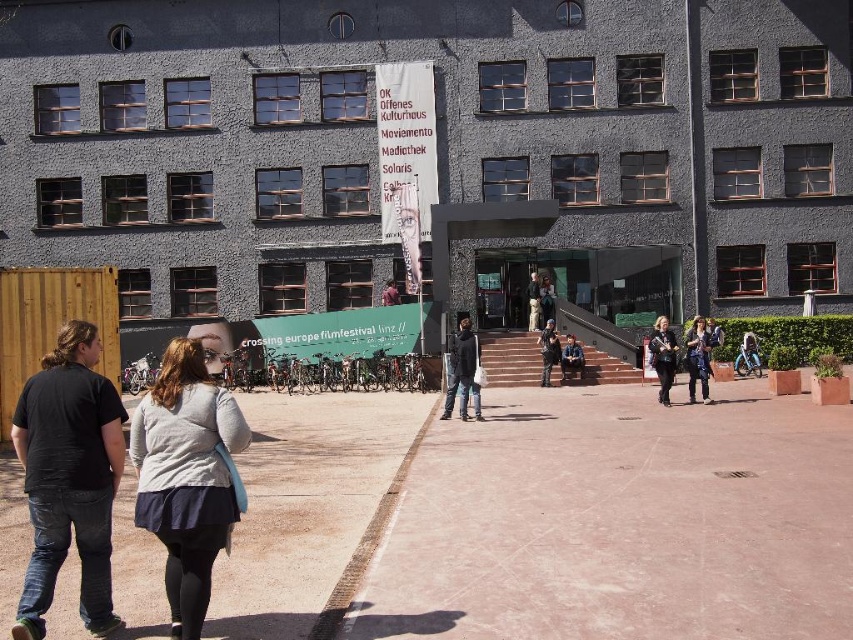
Which of these two, light gray sweater at center or camouflage jacket at center, stands taller?

camouflage jacket at center

Is light gray sweater at center to the left of camouflage jacket at center from the viewer's perspective?

Yes, light gray sweater at center is to the left of camouflage jacket at center.

Does point (180, 573) come in front of point (547, 372)?

Yes, point (180, 573) is in front of point (547, 372).

Where is `light gray sweater at center`? light gray sweater at center is located at coordinates (186, 476).

Can you confirm if metallic silver guitar at center is positioned below denim jacket at center?

Actually, metallic silver guitar at center is above denim jacket at center.

Which is in front, point (691, 381) or point (466, 381)?

Point (466, 381)

Is point (701, 392) positioned behind point (465, 333)?

Yes, it is behind point (465, 333).

The height and width of the screenshot is (640, 853). I want to click on metallic silver guitar at center, so click(x=697, y=358).

Between dark gray jeans at center and black cotton shirt at left, which one has more height?

black cotton shirt at left is taller.

Between point (206, 532) and point (78, 368), which one is positioned in front?

Point (206, 532)

Does point (27, 426) come farther from viewer compared to point (86, 518)?

That is True.

I want to click on dark gray jeans at center, so click(x=68, y=477).